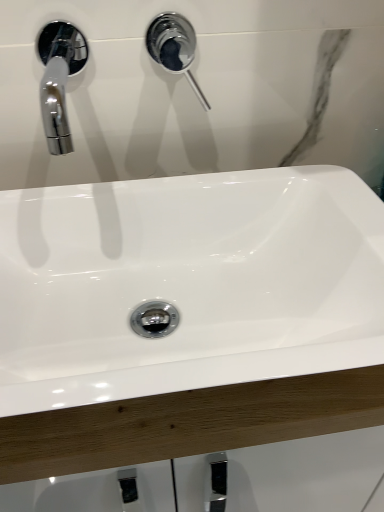
What do you see at coordinates (174, 47) in the screenshot? Image resolution: width=384 pixels, height=512 pixels. I see `chrome/metallic faucet at upper center` at bounding box center [174, 47].

What are the coordinates of `chrome/metallic faucet at upper center` in the screenshot? It's located at (174, 47).

In order to face chrome/metallic faucet at upper center, should I rotate leftwards or rightwards?

Turn left by 1.436 degrees to look at chrome/metallic faucet at upper center.

You are a GUI agent. You are given a task and a screenshot of the screen. Output one action in this format:
    pyautogui.click(x=<x>, y=<y>)
    Task: Click on the chrome/metallic faucet at upper center
    The height and width of the screenshot is (512, 384).
    Given the screenshot: What is the action you would take?
    [x=174, y=47]